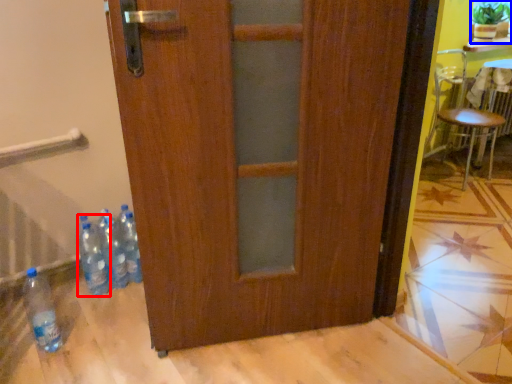
Question: Which object is further to the camera taking this photo, bottle (highlighted by a red box) or houseplant (highlighted by a blue box)?

Choices:
 (A) bottle
 (B) houseplant

Answer: (B)